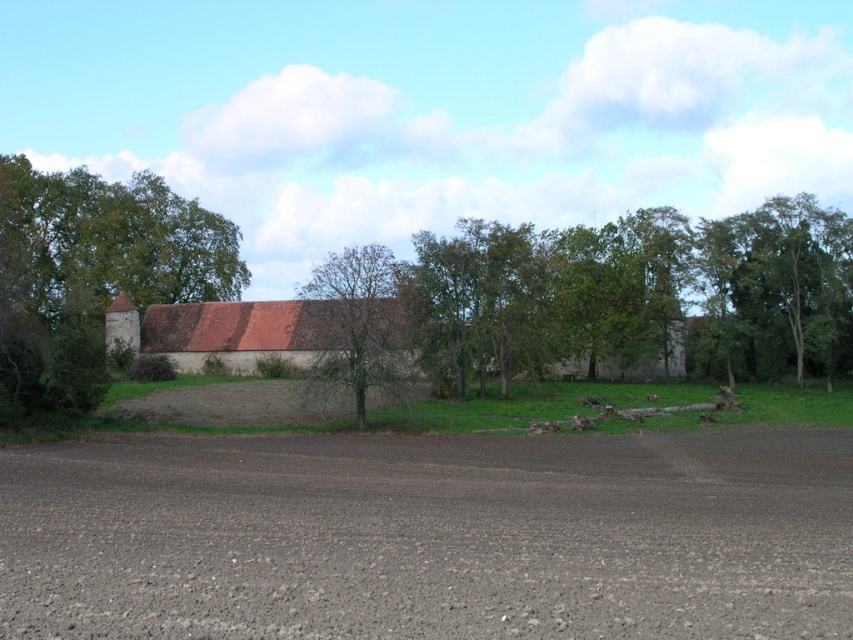
Does brown soil at lower center have a larger size compared to bare wood tree at center?

No.

Is brown soil at lower center taller than bare wood tree at center?

No.

Which is in front, point (460, 472) or point (378, 308)?

Point (460, 472)

Find the location of a particular element. brown soil at lower center is located at coordinates [431, 538].

Who is positioned more to the left, green leafy tree at upper right or green grass at center?

Positioned to the left is green grass at center.

Is point (776, 214) closer to camera compared to point (252, 420)?

No, it is not.

Where is `green leafy tree at upper right`? green leafy tree at upper right is located at coordinates (776, 289).

Looking at this image, who is positioned more to the right, green leafy tree at left or brown clay barn at center?

brown clay barn at center is more to the right.

Is green leafy tree at left below brown clay barn at center?

No.

Does point (209, 289) come behind point (206, 356)?

Yes, it is behind point (206, 356).

Find the location of a particular element. The width and height of the screenshot is (853, 640). green leafy tree at left is located at coordinates point(91,275).